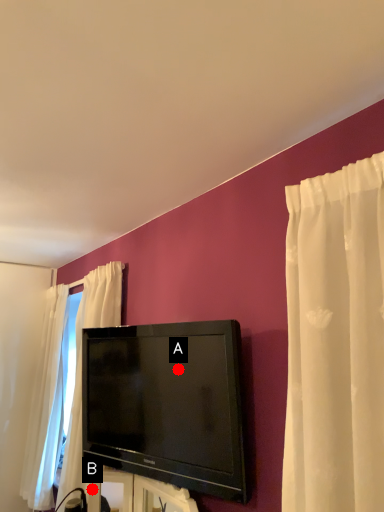
Question: Two points are circled on the image, labeled by A and B beside each circle. Which of the following is the farthest from the observer?

Choices:
 (A) A is further
 (B) B is further

Answer: (B)